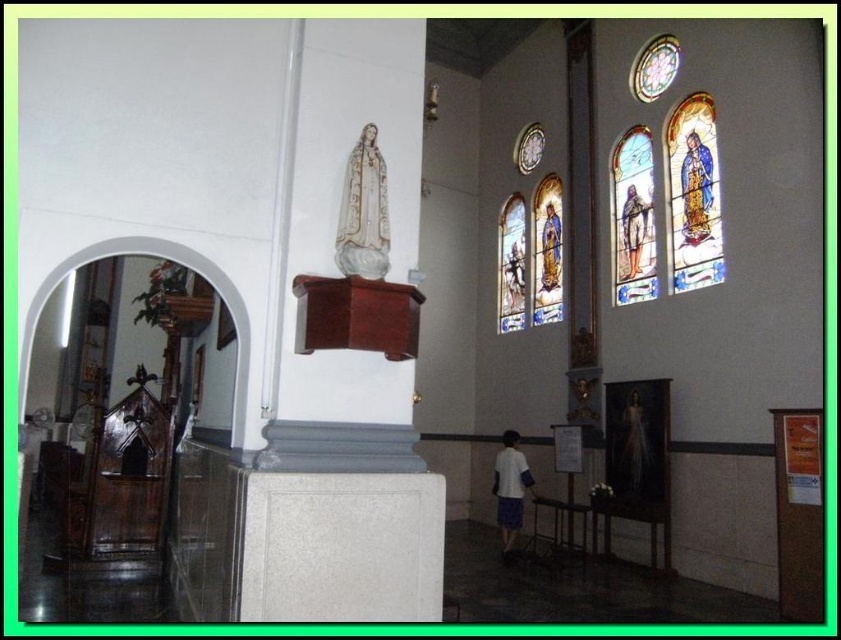
Question: Does translucent ethereal figure at center appear over matte white statue at center?

Choices:
 (A) no
 (B) yes

Answer: (A)

Question: Among these points, which one is nearest to the camera?

Choices:
 (A) (517, 272)
 (B) (517, 512)
 (C) (551, 298)

Answer: (B)

Question: Can you confirm if white glossy statue at upper center is positioned to the right of matte white statue at center?

Choices:
 (A) yes
 (B) no

Answer: (B)

Question: Which object is positioned farthest from the blue fabric figure at center?

Choices:
 (A) stained glass window at upper right
 (B) translucent ethereal figure at center

Answer: (B)

Question: Among these objects, which one is nearest to the camera?

Choices:
 (A) translucent ethereal figure at center
 (B) white cotton shirt at center
 (C) translucent stained glass at center

Answer: (A)

Question: Is blue fabric figure at upper right further to the viewer compared to matte gold statue at center?

Choices:
 (A) yes
 (B) no

Answer: (B)